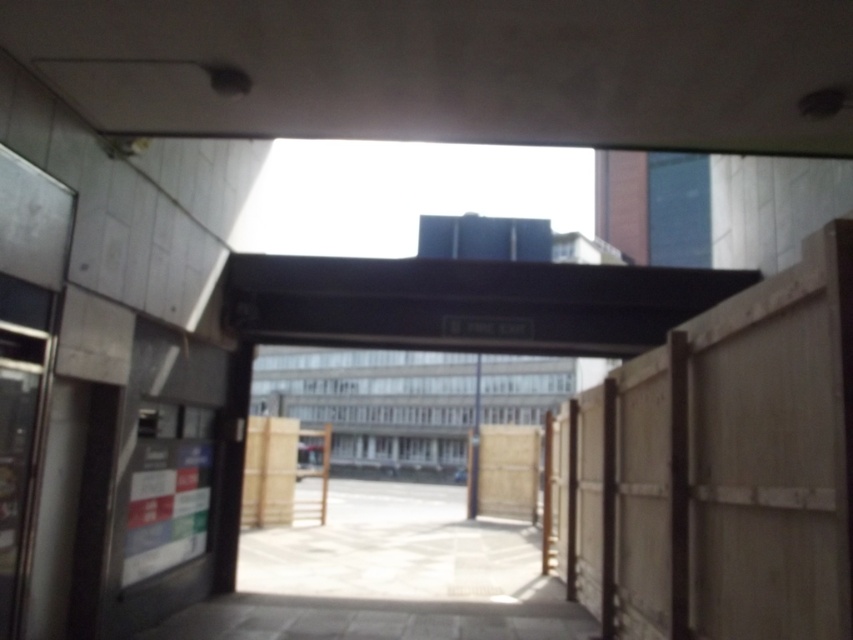
From the picture: You are standing in the courtyard and want to take a photo of the black matte overpass at center. Where should you position yourself to capture it in the frame?

You should position yourself at point (x=466, y=304) to capture the black matte overpass at center in the frame.

You are a delivery person with a large cart that is 3 meters wide. You need to pass through the black matte overpass at center and the gray concrete parking garage at center. Which one can your cart fit through?

The black matte overpass at center is narrower than the gray concrete parking garage at center. Since your cart is 3 meters wide, it can only fit through the gray concrete parking garage at center if its width is at least 3 meters. However, the description only states the overpass is narrower, so without exact measurements, we can only confirm the garage is wider than the overpass. Please check the garage width first.